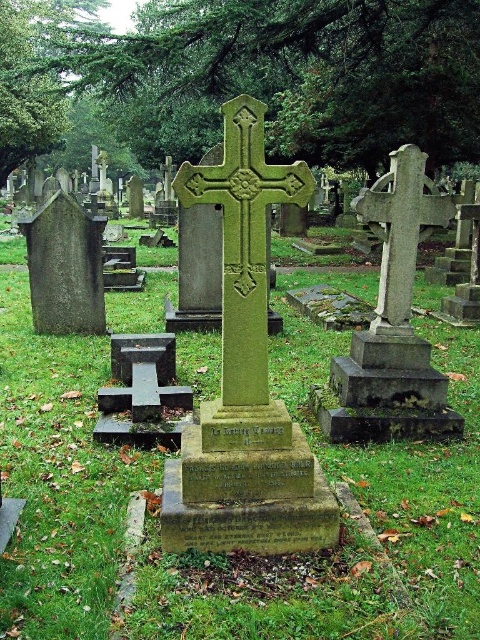
Is point (204, 385) positioned after point (225, 186)?

That is True.

Is green grass at center to the left of green stone cross at center from the viewer's perspective?

Yes, green grass at center is to the left of green stone cross at center.

Between point (32, 634) and point (240, 288), which one is positioned in front?

Point (32, 634) is in front.

Identify the location of green grass at center. The width and height of the screenshot is (480, 640). (60, 477).